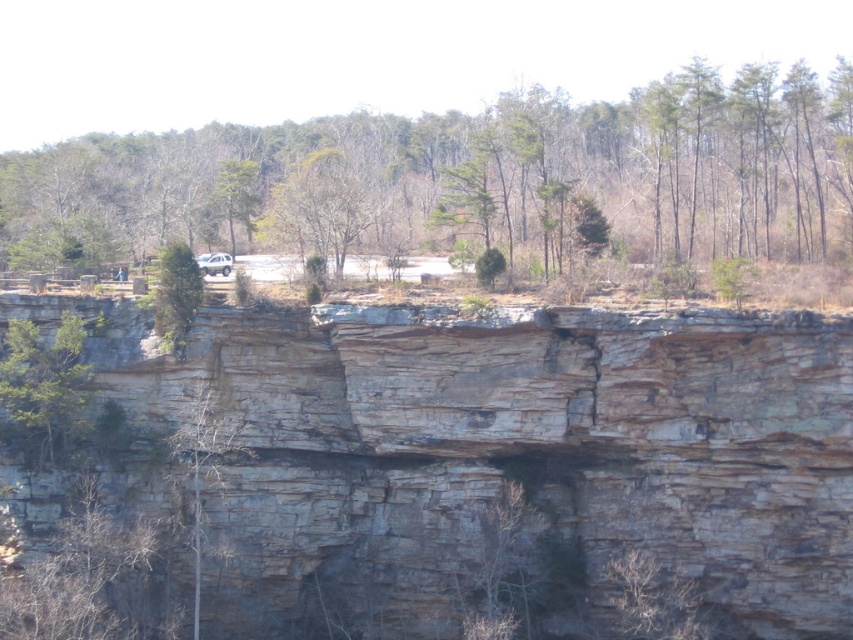
Question: Which object appears closest to the camera in this image?

Choices:
 (A) green leafy tree at upper left
 (B) gray rock cliff at center
 (C) green leafy tree at upper center

Answer: (B)

Question: Is green leafy tree at upper center bigger than green leafy tree at left?

Choices:
 (A) no
 (B) yes

Answer: (B)

Question: Does green leafy tree at upper center appear on the left side of green leafy tree at left?

Choices:
 (A) no
 (B) yes

Answer: (A)

Question: Which point is farther to the camera?

Choices:
 (A) gray rock cliff at center
 (B) green leafy tree at left
 (C) green leafy tree at upper center

Answer: (C)

Question: Which object is farther from the camera taking this photo?

Choices:
 (A) gray rock cliff at center
 (B) green leafy tree at upper left
 (C) green leafy tree at upper center
 (D) green leafy tree at left

Answer: (C)

Question: Is green leafy tree at upper center behind green leafy tree at upper left?

Choices:
 (A) no
 (B) yes

Answer: (B)